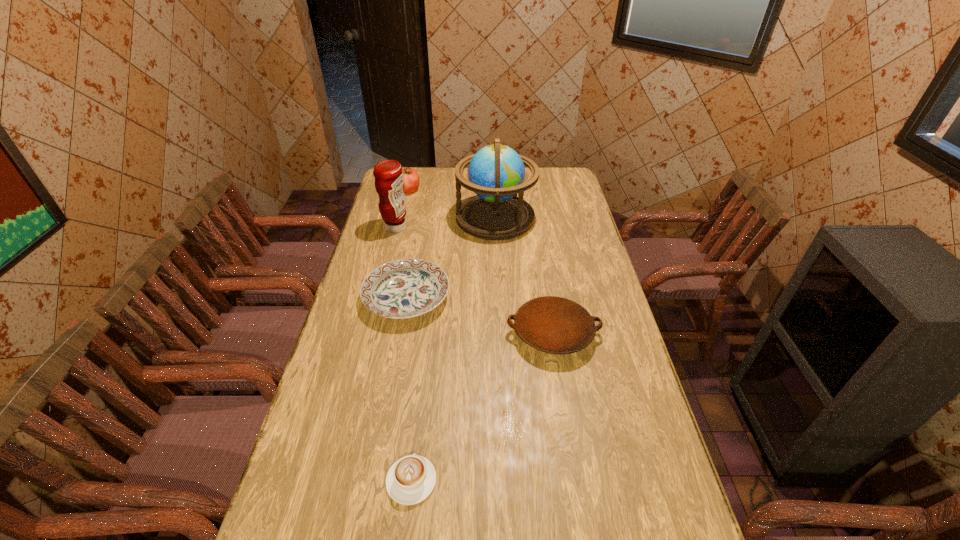
You are a GUI agent. You are given a task and a screenshot of the screen. Output one action in this format:
    pyautogui.click(x=<x>, y=<y>)
    Task: Click on the vacant space located on the front of the third tallest object
    
    Given the screenshot: What is the action you would take?
    pyautogui.click(x=399, y=230)

Image resolution: width=960 pixels, height=540 pixels. Identify the location of free space located 0.160m on the left of the third shortest object. pyautogui.click(x=457, y=334).

You are a GUI agent. You are given a task and a screenshot of the screen. Output one action in this format:
    pyautogui.click(x=<x>, y=<y>)
    Task: Click on the free space located on the front of the shorter plate
    The image size is (960, 540).
    Given the screenshot: What is the action you would take?
    pyautogui.click(x=394, y=372)

This screenshot has height=540, width=960. Identify the location of vacant area situated 0.170m with the handle on the right side of the nearest object. (420, 399).

Locate an element on the screen. The height and width of the screenshot is (540, 960). vacant area situated 0.050m with the handle on the right side of the nearest object is located at coordinates (417, 438).

Find the location of a particular element. This screenshot has height=540, width=960. free space located 0.210m with the handle on the right side of the nearest object is located at coordinates (422, 387).

Where is `object that is at the far edge`? Image resolution: width=960 pixels, height=540 pixels. object that is at the far edge is located at coordinates pyautogui.click(x=411, y=181).

Identify the location of condiment present at the left edge. Image resolution: width=960 pixels, height=540 pixels. (388, 175).

Identify the location of apple situated at the left edge. [x=411, y=181].

Locate an element on the screen. This screenshot has height=540, width=960. plate that is positioned at the left edge is located at coordinates (405, 288).